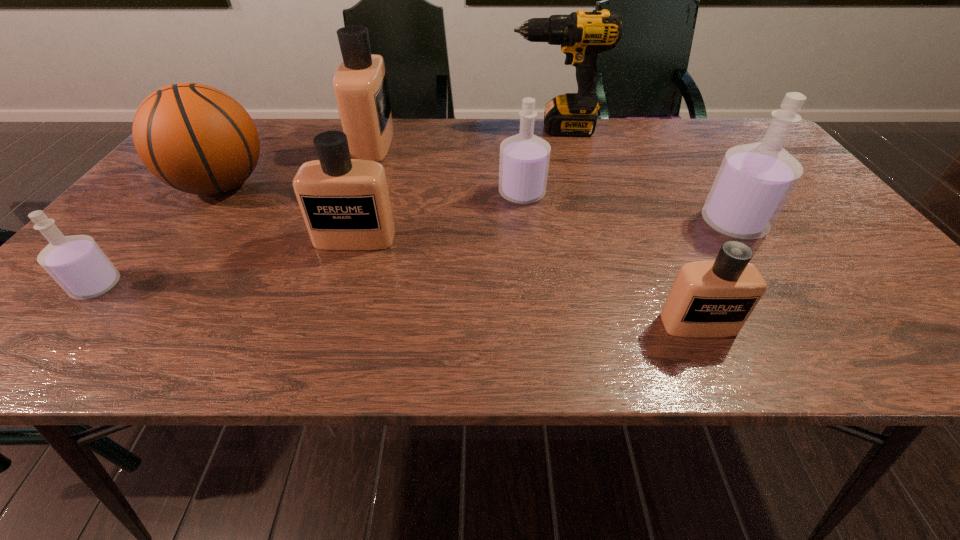
Find the location of a particular element. The height and width of the screenshot is (540, 960). free spot located on the front label of the second nearest beige perfume is located at coordinates (336, 300).

Where is `free space located 0.270m on the back of the second nearest object`? free space located 0.270m on the back of the second nearest object is located at coordinates (175, 195).

Where is `drill present at the far edge`? drill present at the far edge is located at coordinates (582, 35).

Find the location of `perfume that is at the far edge`. perfume that is at the far edge is located at coordinates (360, 85).

Locate an element on the screen. basketball present at the far edge is located at coordinates (195, 138).

You are a GUI agent. You are given a task and a screenshot of the screen. Output one action in this format:
    pyautogui.click(x=<x>, y=<y>)
    Task: Click on the object present at the near edge
    This screenshot has width=960, height=540.
    Given the screenshot: What is the action you would take?
    pyautogui.click(x=714, y=298)

In order to click on basketball that is at the left edge in this screenshot , I will do `click(195, 138)`.

You are a GUI agent. You are given a task and a screenshot of the screen. Output one action in this format:
    pyautogui.click(x=<x>, y=<y>)
    Task: Click on the perfume situated at the left edge
    
    Given the screenshot: What is the action you would take?
    pyautogui.click(x=80, y=267)

I want to click on object situated at the far left corner, so click(195, 138).

This screenshot has height=540, width=960. I want to click on free point at the far edge, so click(436, 154).